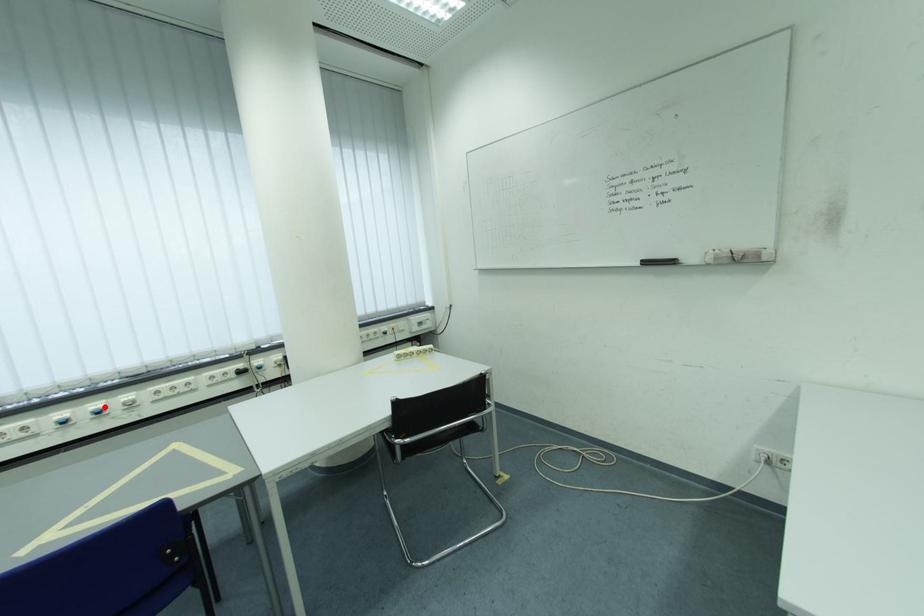
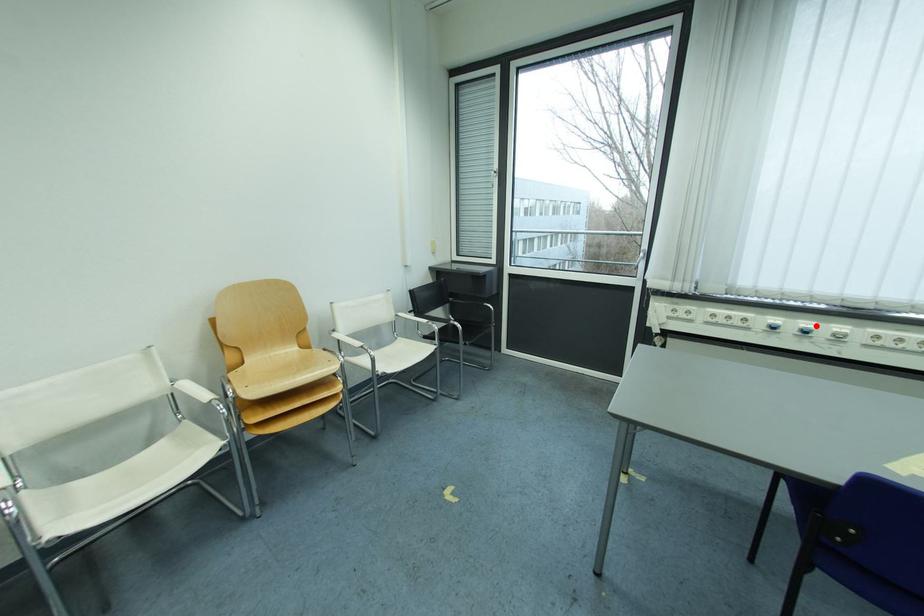
I am providing you with two images of the same scene from different viewpoints. A red point is marked on the first image and another point is marked on the second image. Is the marked point in image1 the same physical position as the marked point in image2?

Yes